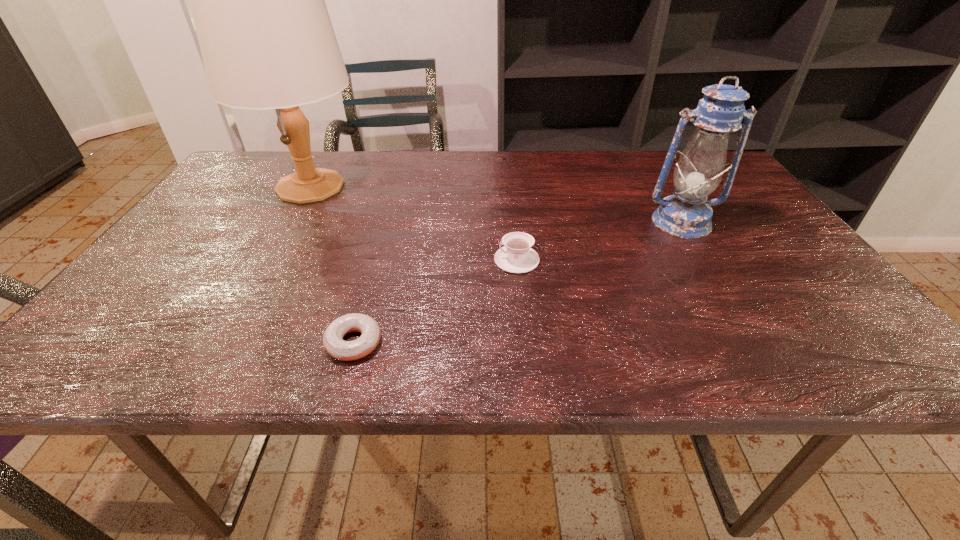
Find the location of a particular element. The image size is (960, 540). free space between the doughnut and the lantern is located at coordinates (517, 282).

Identify the location of free space between the third object from left to right and the third shortest object. The height and width of the screenshot is (540, 960). (599, 241).

What are the coordinates of `free spot between the rightmost object and the leftmost object` in the screenshot? It's located at point(495,204).

You are a GUI agent. You are given a task and a screenshot of the screen. Output one action in this format:
    pyautogui.click(x=<x>, y=<y>)
    Task: Click on the object that is the third nearest to the rightmost object
    The width and height of the screenshot is (960, 540).
    Given the screenshot: What is the action you would take?
    tap(267, 42)

Locate an element on the screen. object that is the second closest to the rightmost object is located at coordinates (333, 342).

This screenshot has height=540, width=960. What are the coordinates of `free point that satisfies the following two spatial constraints: 1. on the front-facing side of the lantern; 2. on the handle side of the second nearest object` in the screenshot? It's located at (705, 260).

The width and height of the screenshot is (960, 540). Identify the location of free location that satisfies the following two spatial constraints: 1. on the front-facing side of the third shortest object; 2. on the handle side of the third farthest object. (705, 260).

Identify the location of free point that satisfies the following two spatial constraints: 1. on the front side of the shortest object; 2. on the right side of the table lamp. This screenshot has height=540, width=960. (220, 342).

Find the location of a particular element. The height and width of the screenshot is (540, 960). free space that satisfies the following two spatial constraints: 1. on the front-facing side of the second tallest object; 2. on the handle side of the teacup is located at coordinates click(x=705, y=260).

I want to click on vacant position in the image that satisfies the following two spatial constraints: 1. on the front-facing side of the rightmost object; 2. on the handle side of the third tallest object, so click(x=705, y=260).